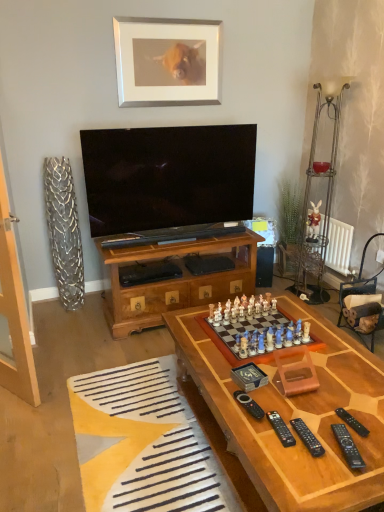
What are the coordinates of `vacant point to the right of black plastic remote at lower right, marked as the 2th remote in a right-to-left arrangement` in the screenshot? It's located at (370, 443).